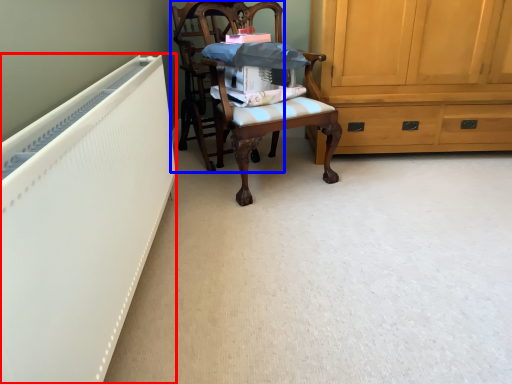
Question: Among these objects, which one is nearest to the camera, radiator (highlighted by a red box) or chair (highlighted by a blue box)?

Choices:
 (A) radiator
 (B) chair

Answer: (A)